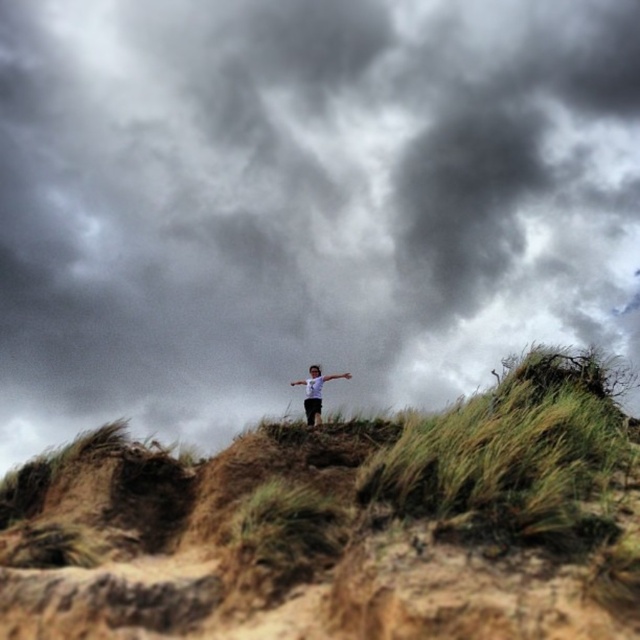
You are a photographer trying to capture the scene of the brown grassy hillside at center and the white matte shirt at center. Based on their heights, which object would appear larger in the photo?

The white matte shirt at center would appear larger in the photo since it is taller than the brown grassy hillside at center.

You are planning to take a photo of the dark gray cloud at upper center and the brown grassy hillside at center from a position where both are visible. Which object will appear bigger in the photo?

The dark gray cloud at upper center will appear bigger in the photo because it has a larger size compared to the brown grassy hillside at center.

You are planning to take a photo of the white matte shirt at center and the dark gray cloud at upper center. Considering their sizes in the image, which object would appear bigger in your photo?

The dark gray cloud at upper center would appear bigger in the photo since it has a larger size compared to the white matte shirt at center.